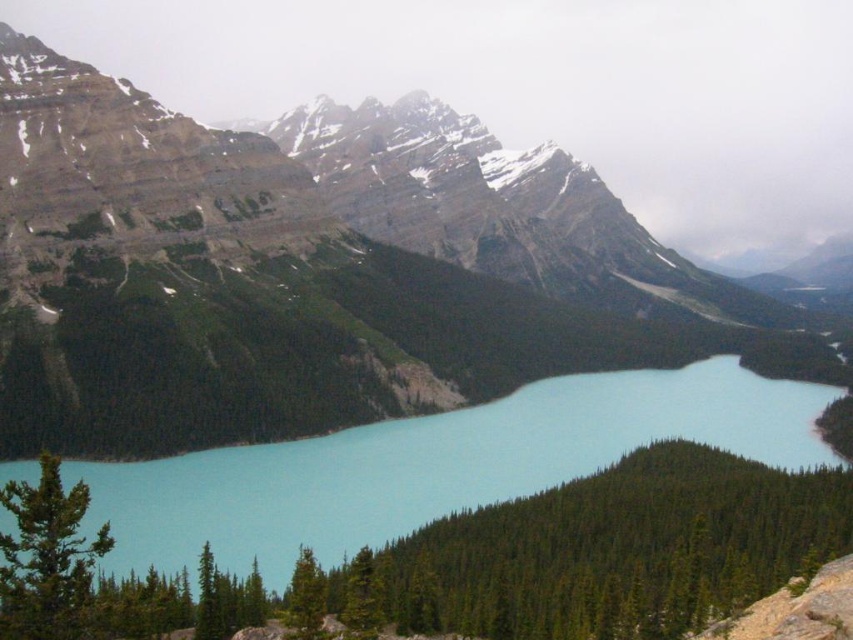
Is point (30, 339) positioned before point (730, 444)?

Yes.

This screenshot has width=853, height=640. Find the location of `rocky mountain at upper left`. rocky mountain at upper left is located at coordinates (299, 284).